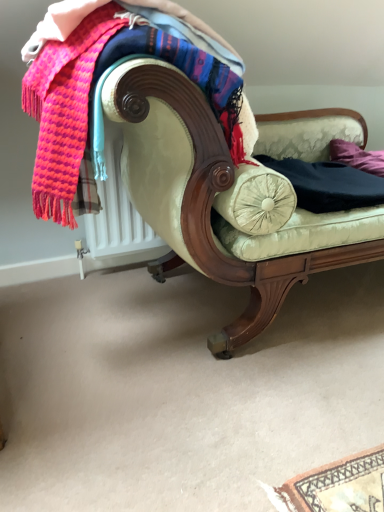
Question: In terms of size, does knitted wool scarf at upper left appear bigger or smaller than black cotton pants at center?

Choices:
 (A) big
 (B) small

Answer: (A)

Question: From the image's perspective, is knitted wool scarf at upper left above or below black cotton pants at center?

Choices:
 (A) below
 (B) above

Answer: (B)

Question: Considering the real-world distances, which object is closest to the knitted wool scarf at upper left?

Choices:
 (A) velvet cream couch at center
 (B) black cotton pants at center
 (C) purple fabric pillow at right

Answer: (A)

Question: Based on their relative distances, which object is nearer to the knitted wool scarf at upper left?

Choices:
 (A) purple fabric pillow at right
 (B) velvet cream couch at center
 (C) black cotton pants at center

Answer: (B)